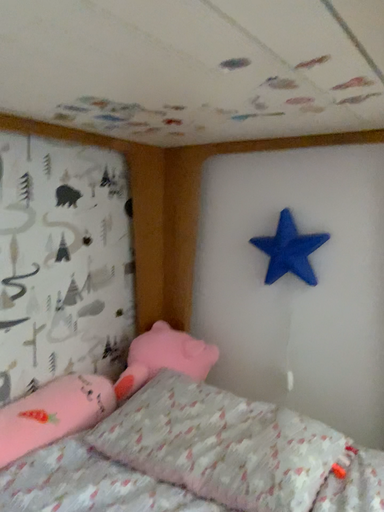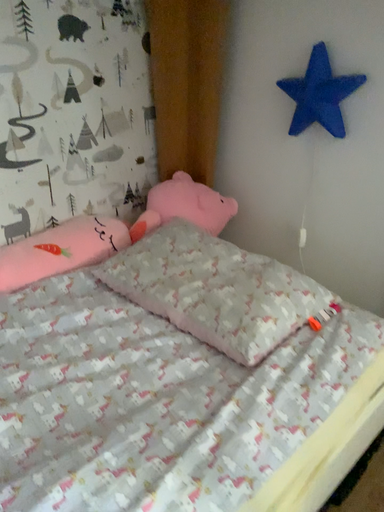
Question: How did the camera likely rotate when shooting the video?

Choices:
 (A) rotated downward
 (B) rotated upward

Answer: (A)